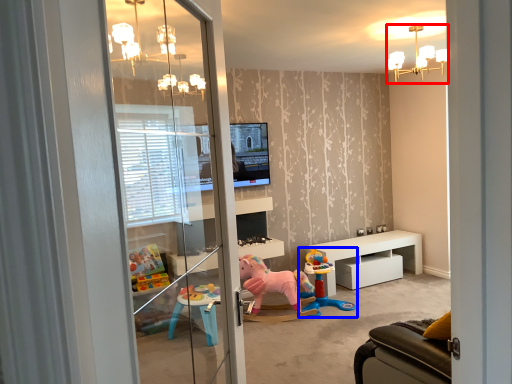
Question: Which object appears farthest to the camera in this image, light fixture (highlighted by a red box) or toy (highlighted by a blue box)?

Choices:
 (A) light fixture
 (B) toy

Answer: (B)